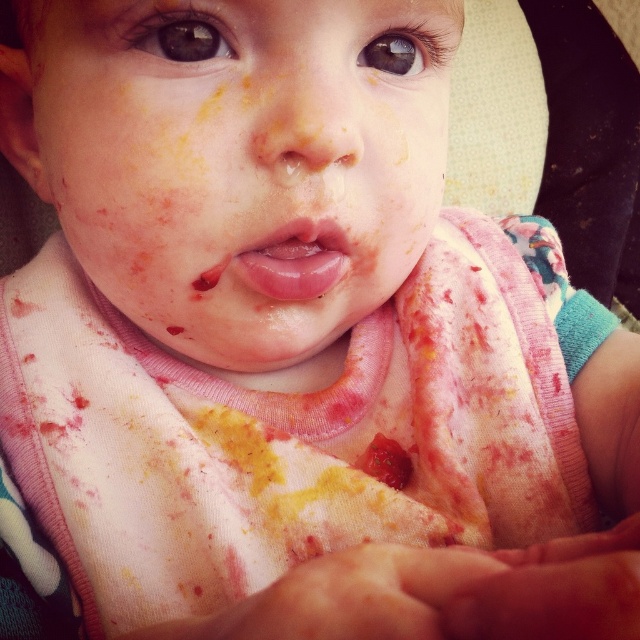
Question: Among these points, which one is nearest to the camera?

Choices:
 (A) (333, 275)
 (B) (392, 291)

Answer: (A)

Question: Can you confirm if matte pink bib at center is thinner than glossy pink lips at center?

Choices:
 (A) yes
 (B) no

Answer: (B)

Question: Is matte pink bib at center to the left of glossy pink lips at center from the viewer's perspective?

Choices:
 (A) yes
 (B) no

Answer: (A)

Question: Does matte pink bib at center have a greater width compared to glossy pink lips at center?

Choices:
 (A) no
 (B) yes

Answer: (B)

Question: Which point is farther to the camera?

Choices:
 (A) glossy pink lips at center
 (B) matte pink bib at center

Answer: (A)

Question: Which point is farther to the camera?

Choices:
 (A) glossy pink lips at center
 (B) matte pink bib at center

Answer: (A)